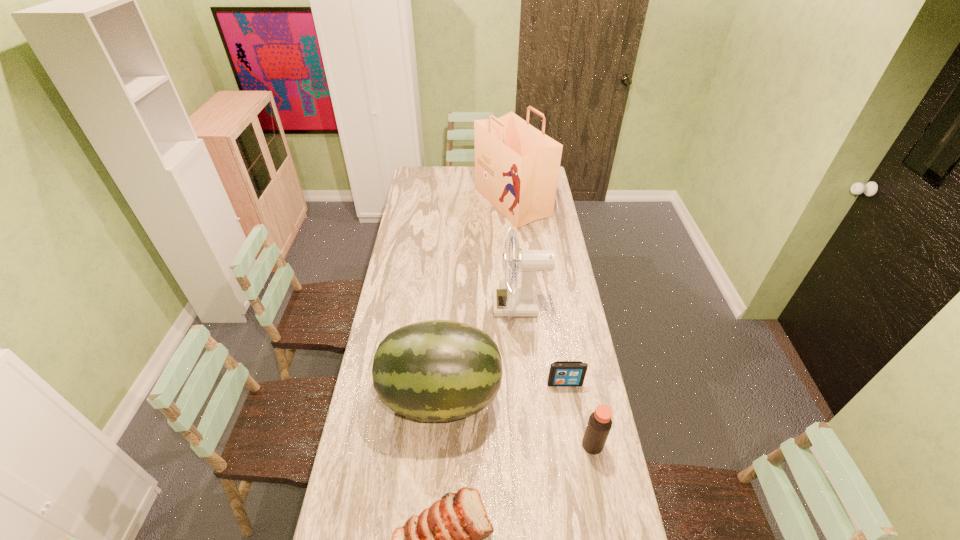
At what (x,y) coordinates should I click in order to perform the action: click on the tallest object. Please return your answer as a coordinate pair (x, y). Looking at the image, I should click on (517, 166).

Locate an element on the screen. The image size is (960, 540). the farthest object is located at coordinates coord(517,166).

The height and width of the screenshot is (540, 960). What are the coordinates of `fan` in the screenshot? It's located at click(513, 301).

You are a GUI agent. You are given a task and a screenshot of the screen. Output one action in this format:
    pyautogui.click(x=<x>, y=<y>)
    Task: Click on the fifth nearest object
    
    Given the screenshot: What is the action you would take?
    pyautogui.click(x=513, y=301)

I want to click on watermelon, so click(438, 370).

Image resolution: width=960 pixels, height=540 pixels. I want to click on vinegar, so click(599, 425).

At what (x,y) coordinates should I click in order to perform the action: click on the fifth tallest object. Please return your answer as a coordinate pair (x, y). This screenshot has width=960, height=540. Looking at the image, I should click on (562, 373).

Identify the location of free space located 0.180m on the side of the tallest object with the superhero design. The image size is (960, 540). (443, 202).

You are a GUI agent. You are given a task and a screenshot of the screen. Output one action in this format:
    pyautogui.click(x=<x>, y=<y>)
    Task: Click on the free space located on the side of the tallest object with the superhero design
    
    Given the screenshot: What is the action you would take?
    pyautogui.click(x=446, y=202)

Image resolution: width=960 pixels, height=540 pixels. What are the coordinates of `free space located on the side of the tallest object with the superhero design` in the screenshot? It's located at (466, 202).